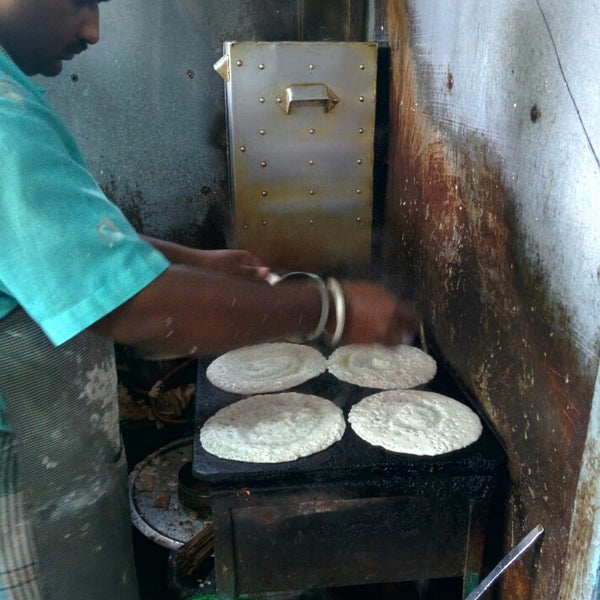
Locate an element on the screen. The width and height of the screenshot is (600, 600). griddle is located at coordinates (349, 448).